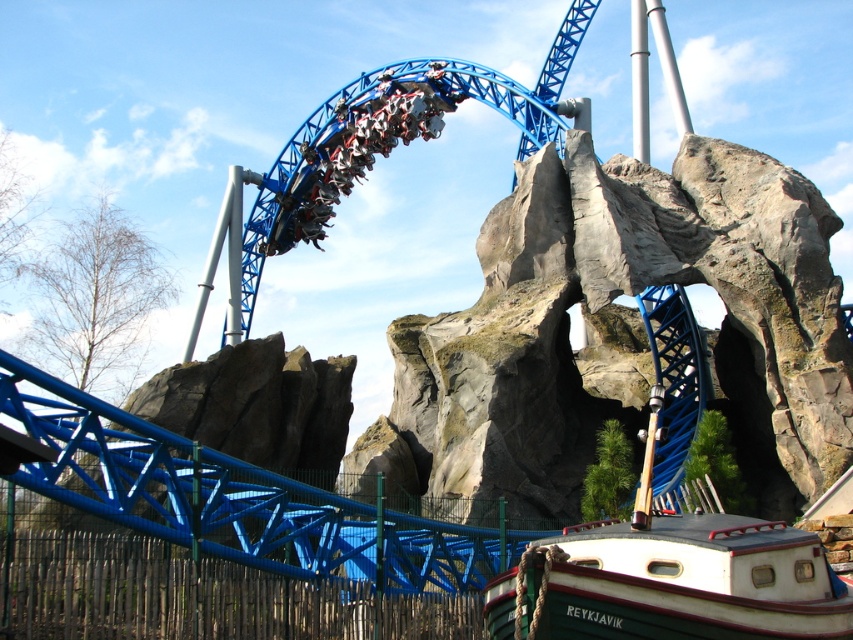
Between rough stone rock at center and white matte boat at lower right, which one has less height?

Standing shorter between the two is white matte boat at lower right.

Is rough stone rock at center taller than white matte boat at lower right?

Indeed, rough stone rock at center has a greater height compared to white matte boat at lower right.

Is point (593, 224) closer to camera compared to point (784, 545)?

No, (593, 224) is further to viewer.

Locate an element on the screen. The height and width of the screenshot is (640, 853). rough stone rock at center is located at coordinates (621, 332).

Can you confirm if rough stone rock at center is thinner than shiny blue roller coaster at upper center?

Yes.

From the picture: Is rough stone rock at center above shiny blue roller coaster at upper center?

No.

Which is behind, point (837, 284) or point (355, 172)?

The point (355, 172) is behind.

This screenshot has width=853, height=640. Identify the location of rough stone rock at center. (621, 332).

Can you confirm if white matte boat at lower right is positioned to the right of shiny blue roller coaster at upper center?

Yes, white matte boat at lower right is to the right of shiny blue roller coaster at upper center.

Who is positioned more to the left, white matte boat at lower right or shiny blue roller coaster at upper center?

shiny blue roller coaster at upper center

Describe the element at coordinates (672, 582) in the screenshot. I see `white matte boat at lower right` at that location.

In order to click on white matte boat at lower right in this screenshot , I will do `click(672, 582)`.